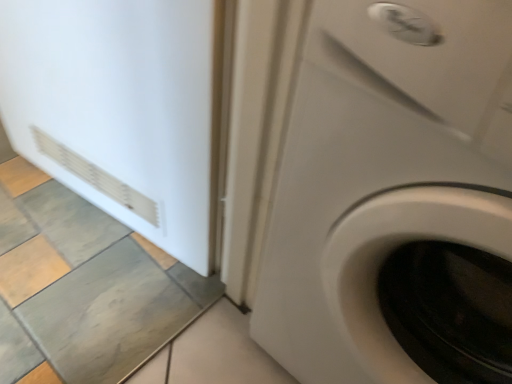
Question: Can you confirm if white glossy washing machine at center is bigger than white matte refrigerator at left?

Choices:
 (A) no
 (B) yes

Answer: (B)

Question: Would you consider white glossy washing machine at center to be distant from white matte refrigerator at left?

Choices:
 (A) yes
 (B) no

Answer: (B)

Question: Is white glossy washing machine at center wider than white matte refrigerator at left?

Choices:
 (A) no
 (B) yes

Answer: (B)

Question: Is white glossy washing machine at center closer to the viewer compared to white matte refrigerator at left?

Choices:
 (A) no
 (B) yes

Answer: (B)

Question: Are white glossy washing machine at center and white matte refrigerator at left making contact?

Choices:
 (A) no
 (B) yes

Answer: (A)

Question: From the image's perspective, does white glossy washing machine at center appear lower than white matte refrigerator at left?

Choices:
 (A) no
 (B) yes

Answer: (B)

Question: Considering the relative positions of white matte refrigerator at left and white glossy washing machine at center in the image provided, is white matte refrigerator at left to the right of white glossy washing machine at center from the viewer's perspective?

Choices:
 (A) no
 (B) yes

Answer: (A)

Question: Does white matte refrigerator at left have a smaller size compared to white glossy washing machine at center?

Choices:
 (A) no
 (B) yes

Answer: (B)

Question: Considering the relative sizes of white matte refrigerator at left and white glossy washing machine at center in the image provided, is white matte refrigerator at left bigger than white glossy washing machine at center?

Choices:
 (A) yes
 (B) no

Answer: (B)

Question: Can you confirm if white matte refrigerator at left is wider than white glossy washing machine at center?

Choices:
 (A) yes
 (B) no

Answer: (B)

Question: Would you say white matte refrigerator at left is a long distance from white glossy washing machine at center?

Choices:
 (A) yes
 (B) no

Answer: (B)

Question: From a real-world perspective, is white matte refrigerator at left physically above white glossy washing machine at center?

Choices:
 (A) no
 (B) yes

Answer: (A)

Question: Looking at the image, does white glossy washing machine at center seem bigger or smaller compared to white matte refrigerator at left?

Choices:
 (A) big
 (B) small

Answer: (A)